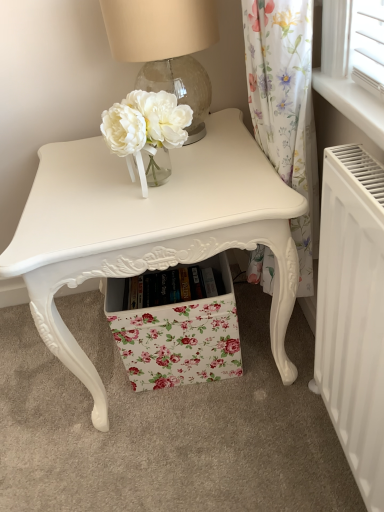
Locate an element on the screen. vacant space that is to the left of translucent glass table lamp at upper center is located at coordinates click(x=82, y=161).